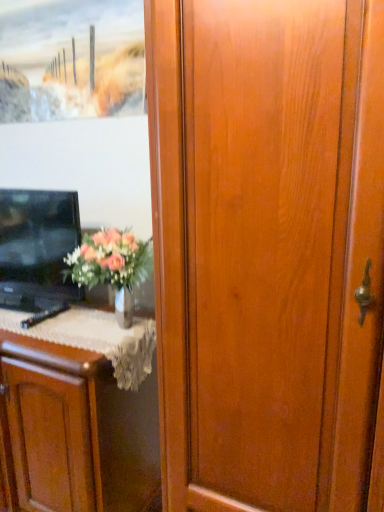
In order to face black glossy tv at left, should I rotate leftwards or rightwards?

To face it directly, rotate left by 20.905 degrees.

The width and height of the screenshot is (384, 512). I want to click on black glossy tv at left, so click(37, 248).

Find the location of a particular element. This screenshot has width=384, height=512. wooden frame at upper left is located at coordinates [70, 59].

Is black glossy tv at left at the back of matte wood cabinet at left?

No, black glossy tv at left is not at the back of matte wood cabinet at left.

In the scene shown: Considering the sizes of objects matte wood cabinet at left and black glossy tv at left in the image provided, who is shorter, matte wood cabinet at left or black glossy tv at left?

Standing shorter between the two is black glossy tv at left.

From a real-world perspective, between matte wood cabinet at left and black glossy tv at left, who is vertically higher?

black glossy tv at left, from a real-world perspective.

Is matte wood cabinet at left positioned behind black glossy tv at left?

No, matte wood cabinet at left is closer to the viewer.

How much distance is there between matte wood cabinet at left and wooden frame at upper left?

They are 1.20 meters apart.

From a real-world perspective, relative to wooden frame at upper left, is matte wood cabinet at left vertically above or below?

matte wood cabinet at left is below wooden frame at upper left.

Is matte wood cabinet at left turned away from wooden frame at upper left?

That's not correct — matte wood cabinet at left is not looking away from wooden frame at upper left.

Based on the photo, does matte wood cabinet at left lie behind wooden frame at upper left?

No, it is in front of wooden frame at upper left.

Which of these two, black glossy tv at left or wooden frame at upper left, is wider?

Wider between the two is black glossy tv at left.

In the scene shown: Is black glossy tv at left positioned far away from wooden frame at upper left?

No, black glossy tv at left is not far away from wooden frame at upper left.

From the image's perspective, is black glossy tv at left above or below wooden frame at upper left?

From the image's perspective, black glossy tv at left appears below wooden frame at upper left.

From the image's perspective, which one is positioned lower, wooden frame at upper left or black glossy tv at left?

black glossy tv at left, from the image's perspective.

Which is more to the right, wooden frame at upper left or black glossy tv at left?

From the viewer's perspective, wooden frame at upper left appears more on the right side.

Can black glossy tv at left be found inside wooden frame at upper left?

No.

Considering the relative sizes of wooden frame at upper left and black glossy tv at left in the image provided, is wooden frame at upper left shorter than black glossy tv at left?

Indeed, wooden frame at upper left has a lesser height compared to black glossy tv at left.

Which of these two, wooden frame at upper left or matte wood cabinet at left, is thinner?

wooden frame at upper left is thinner.

Is point (123, 53) farther from camera compared to point (41, 465)?

That is True.

From a real-world perspective, is wooden frame at upper left on top of matte wood cabinet at left?

Yes, from a real-world perspective, wooden frame at upper left is above matte wood cabinet at left.

Is wooden frame at upper left bigger or smaller than matte wood cabinet at left?

In the image, wooden frame at upper left appears to be smaller than matte wood cabinet at left.

Can you see black glossy tv at left touching matte wood cabinet at left?

black glossy tv at left and matte wood cabinet at left are not in contact.

From a real-world perspective, is black glossy tv at left below matte wood cabinet at left?

No.

Is black glossy tv at left aimed at matte wood cabinet at left?

No, black glossy tv at left is not facing towards matte wood cabinet at left.

Where is `television above the matte wood cabinet at left (from the image's perspective)`? This screenshot has width=384, height=512. television above the matte wood cabinet at left (from the image's perspective) is located at coordinates (37, 248).

Where is `cabinetry that is below the black glossy tv at left (from the image's perspective)`? cabinetry that is below the black glossy tv at left (from the image's perspective) is located at coordinates (51, 425).

Where is `cabinetry located on the left of wooden frame at upper left`? cabinetry located on the left of wooden frame at upper left is located at coordinates (51, 425).

Looking at the image, which one is located further to black glossy tv at left, wooden frame at upper left or matte wood cabinet at left?

wooden frame at upper left is positioned further to the anchor black glossy tv at left.

Looking at the image, which one is located closer to black glossy tv at left, matte wood cabinet at left or wooden frame at upper left?

The object closer to black glossy tv at left is matte wood cabinet at left.

Based on their spatial positions, is black glossy tv at left or matte wood cabinet at left further from wooden frame at upper left?

matte wood cabinet at left lies further to wooden frame at upper left than the other object.

Which object lies nearer to the anchor point matte wood cabinet at left, wooden frame at upper left or black glossy tv at left?

black glossy tv at left.

From the image, which object appears to be farther from matte wood cabinet at left, black glossy tv at left or wooden frame at upper left?

The object further to matte wood cabinet at left is wooden frame at upper left.

Looking at the image, which one is located closer to wooden frame at upper left, matte wood cabinet at left or black glossy tv at left?

The object closer to wooden frame at upper left is black glossy tv at left.

At what (x,y) coordinates should I click in order to perform the action: click on television that lies between wooden frame at upper left and matte wood cabinet at left from top to bottom. Please return your answer as a coordinate pair (x, y). Image resolution: width=384 pixels, height=512 pixels. Looking at the image, I should click on (37, 248).